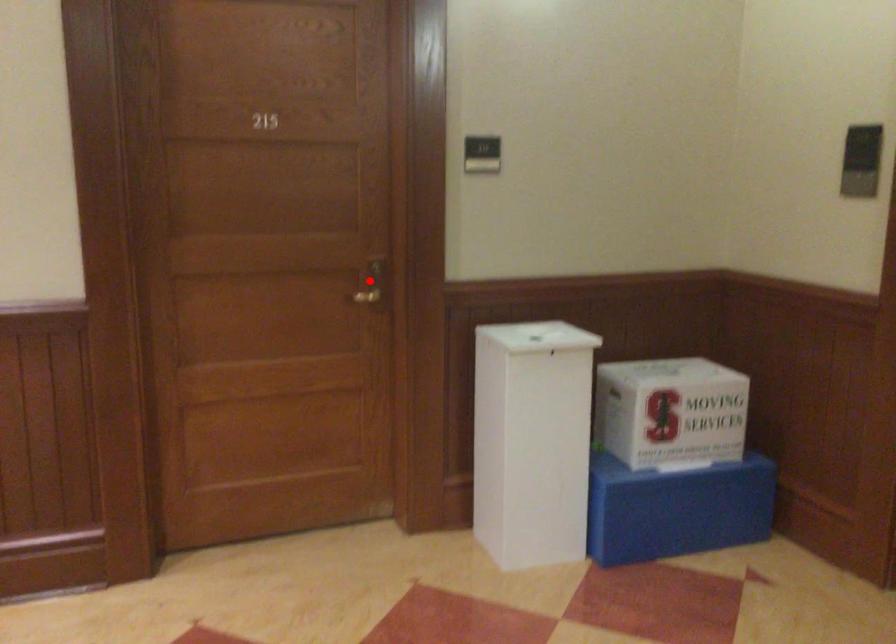
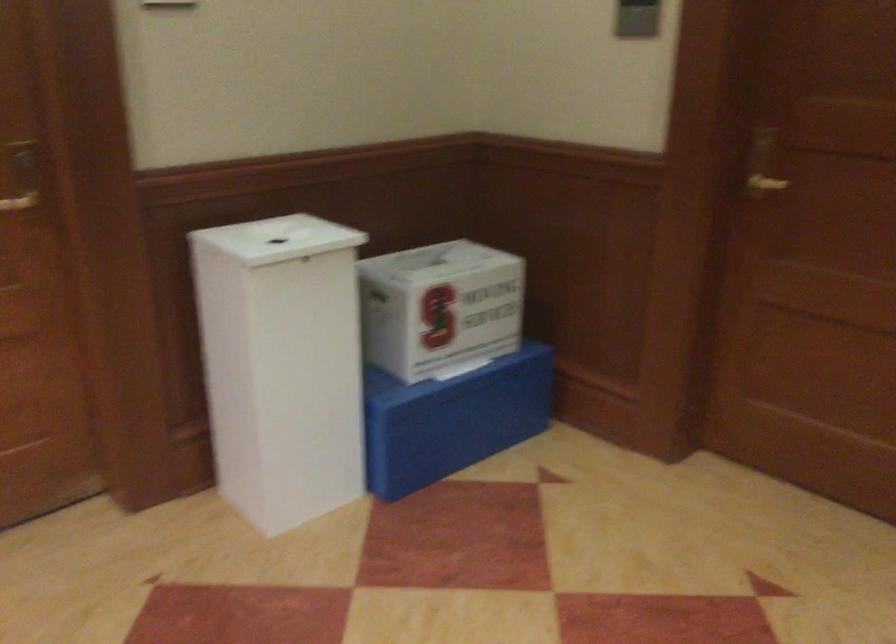
In the second image, find the point that corresponds to the highlighted location in the first image.

(21, 176)